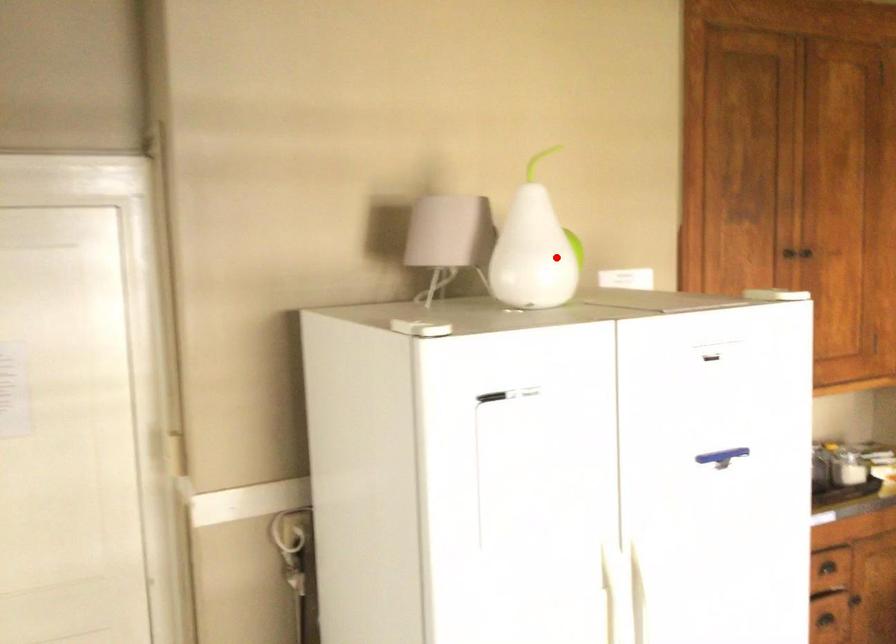
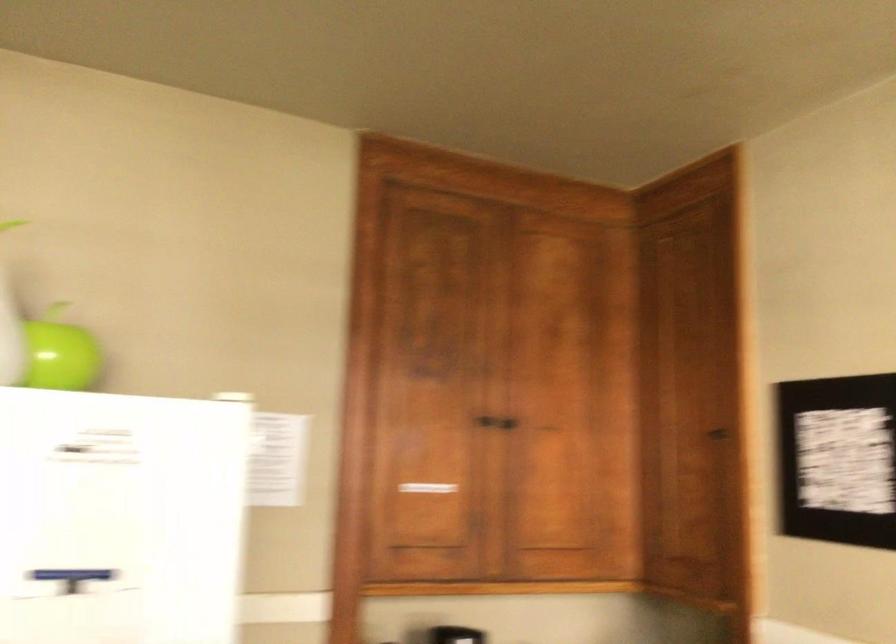
Question: I am providing you with two images of the same scene from different viewpoints. A red point is marked on the first image. Is the red point's position out of view in image 2?

Choices:
 (A) Yes
 (B) No

Answer: (B)